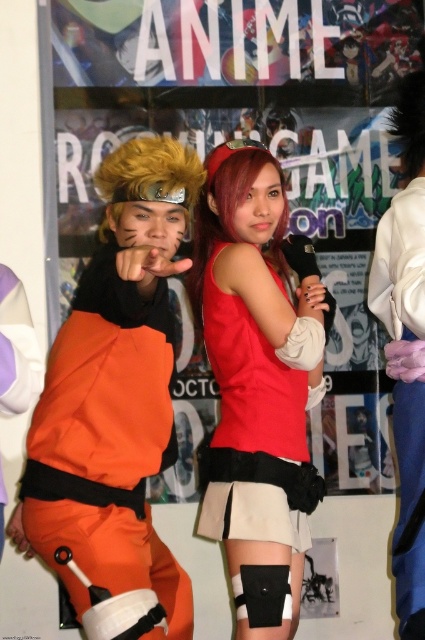
Does orange fabric jumpsuit at center appear on the right side of matte red tank top at center?

Incorrect, orange fabric jumpsuit at center is not on the right side of matte red tank top at center.

Does orange fabric jumpsuit at center have a lesser width compared to matte red tank top at center?

Incorrect, orange fabric jumpsuit at center's width is not less than matte red tank top at center's.

Locate an element on the screen. The width and height of the screenshot is (425, 640). orange fabric jumpsuit at center is located at coordinates (x=116, y=406).